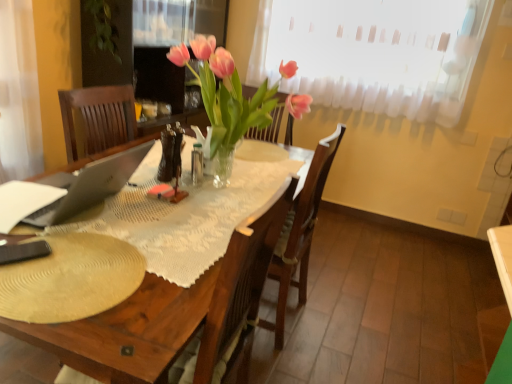
Identify the location of white sheer curtain at upper center. Image resolution: width=512 pixels, height=384 pixels. (374, 53).

What do you see at coordinates (374, 53) in the screenshot?
I see `white sheer curtain at upper center` at bounding box center [374, 53].

Locate an element on the screen. The image size is (512, 384). white sheer curtain at upper center is located at coordinates (374, 53).